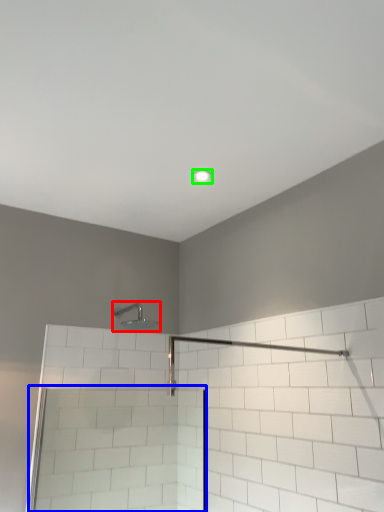
Question: Estimate the real-world distances between objects in this image. Which object is farther from shower (highlighted by a red box), screen door (highlighted by a blue box) or light fixture (highlighted by a green box)?

Choices:
 (A) screen door
 (B) light fixture

Answer: (B)